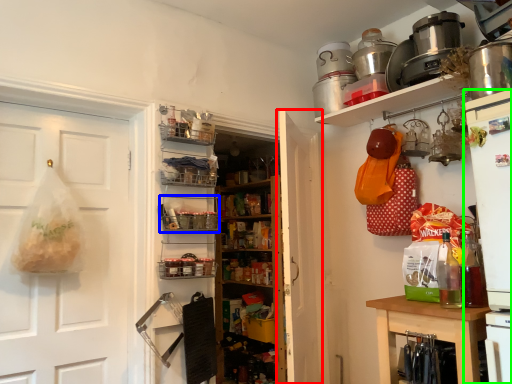
Question: Considering the real-world distances, which object is closest to door (highlighted by a red box)? shelf (highlighted by a blue box) or appliance (highlighted by a green box).

Choices:
 (A) shelf
 (B) appliance

Answer: (A)